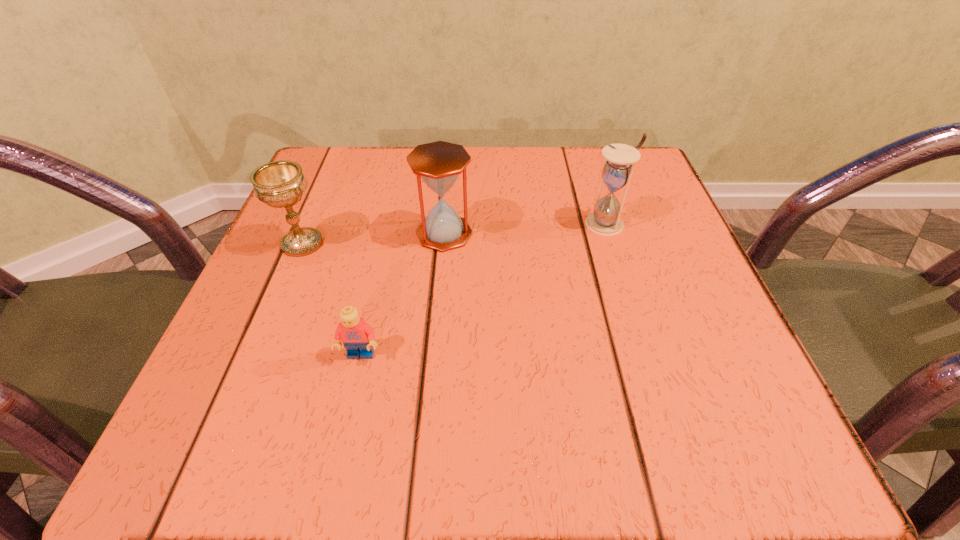
The width and height of the screenshot is (960, 540). In order to click on object positioned at the left edge in this screenshot , I will do `click(278, 184)`.

Image resolution: width=960 pixels, height=540 pixels. I want to click on object located at the right edge, so click(x=605, y=220).

Find the location of a particular element. Image resolution: width=960 pixels, height=540 pixels. object that is at the far right corner is located at coordinates (605, 220).

This screenshot has width=960, height=540. I want to click on vacant space at the far edge of the desktop, so click(x=401, y=168).

Identify the location of vacant space at the near edge of the desktop. The image size is (960, 540). (637, 429).

The width and height of the screenshot is (960, 540). I want to click on free space at the left edge of the desktop, so [x=302, y=220].

Where is `vacant point at the right edge`? The width and height of the screenshot is (960, 540). vacant point at the right edge is located at coordinates (646, 345).

Identify the location of free space at the far left corner. (323, 172).

Image resolution: width=960 pixels, height=540 pixels. In the image, there is a desktop. What are the coordinates of `vacant region at the near left corner` in the screenshot? It's located at (276, 421).

In the image, there is a desktop. Identify the location of free space at the far right corner. Image resolution: width=960 pixels, height=540 pixels. (576, 166).